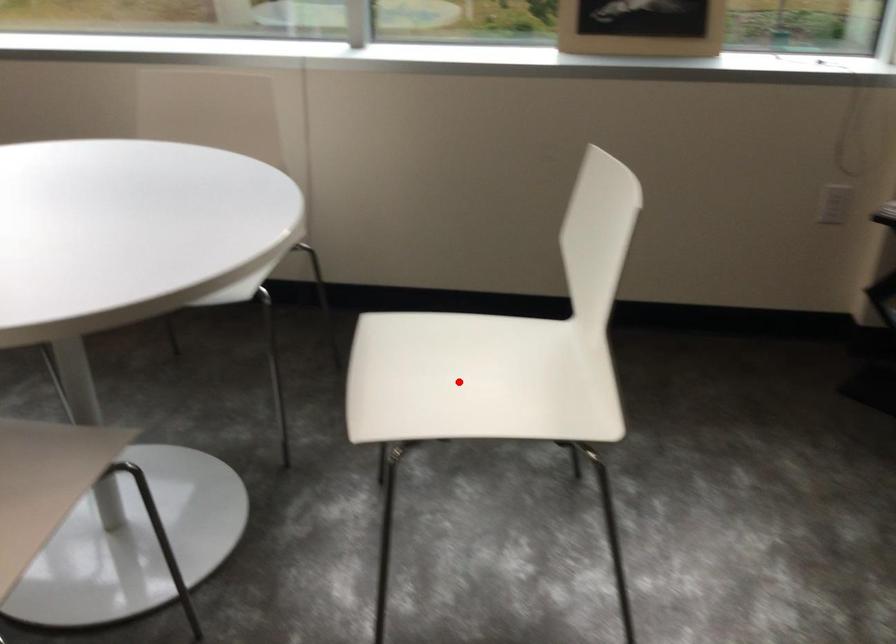
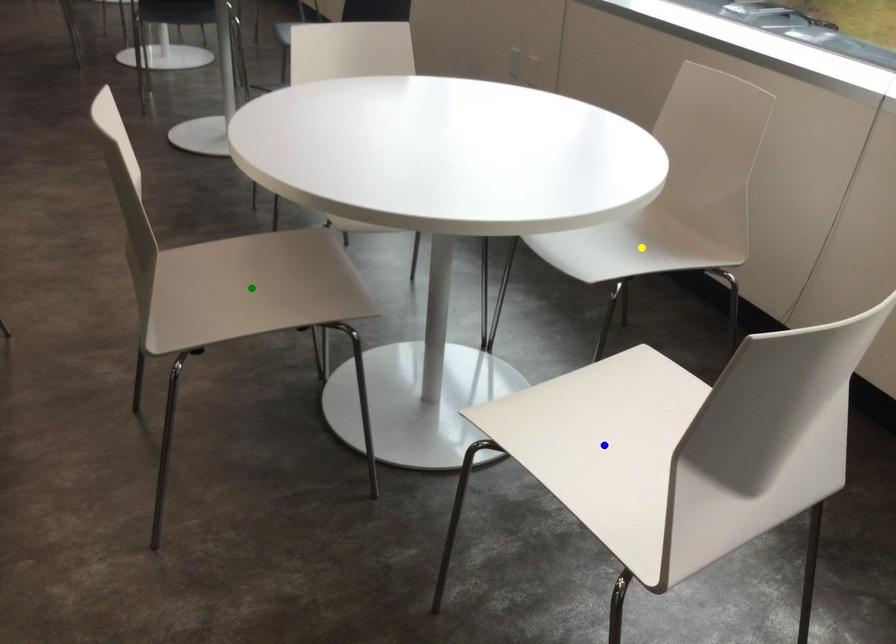
Question: I am providing you with two images of the same scene from different viewpoints. A red point is marked on the first image. You are given multiple points on the second image. Which spot in image 2 lines up with the point in image 1?

Choices:
 (A) yellow point
 (B) blue point
 (C) green point

Answer: (B)